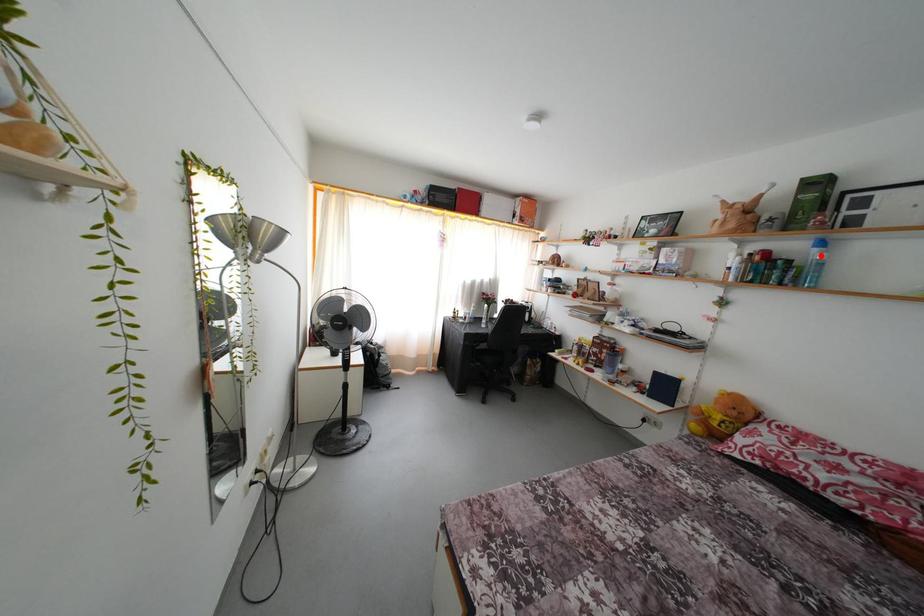
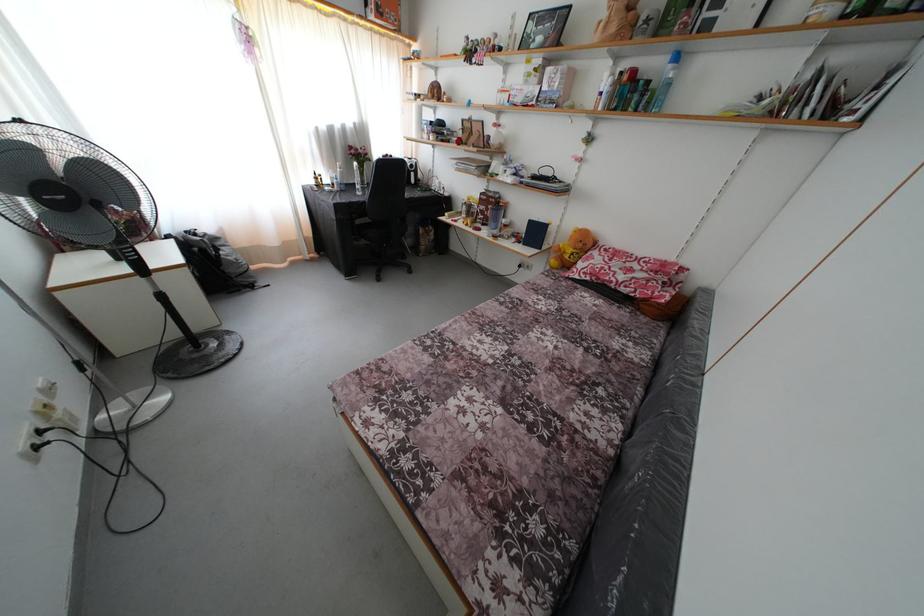
Find the pixel in the second image that matches the highlighted location in the first image.

(675, 73)